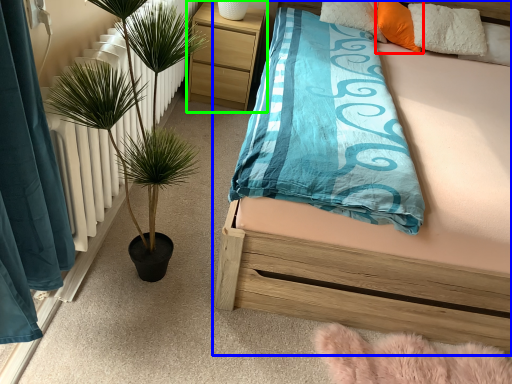
Question: Based on their relative distances, which object is farther from pillow (highlighted by a red box)? Choose from bed (highlighted by a blue box) and nightstand (highlighted by a green box).

Choices:
 (A) bed
 (B) nightstand

Answer: (A)